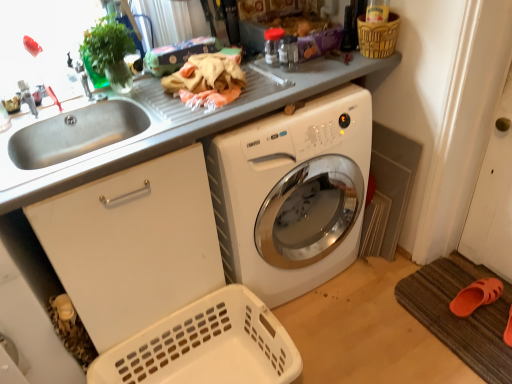
Where is `white glossy washing machine at center`? white glossy washing machine at center is located at coordinates (292, 194).

This screenshot has width=512, height=384. In order to click on white plastic basket at lower left, the 1th basket ordered from the bottom in this screenshot , I will do `click(206, 346)`.

What do you see at coordinates (73, 138) in the screenshot?
I see `stainless steel sink at left` at bounding box center [73, 138].

Locate an element on the screen. brown textured bath mat at lower right is located at coordinates (459, 317).

Is white plastic basket at lower left, the 1th basket ordered from the bottom, not close to brown textured bath mat at lower right?

No, white plastic basket at lower left, the 1th basket ordered from the bottom, is in close proximity to brown textured bath mat at lower right.

In the scene shown: In terms of size, does white plastic basket at lower left, the 1th basket ordered from the bottom, appear bigger or smaller than brown textured bath mat at lower right?

Clearly, white plastic basket at lower left, the 1th basket ordered from the bottom, is larger in size than brown textured bath mat at lower right.

Is point (286, 377) less distant than point (429, 314)?

Yes, it is.

From the image's perspective, is white plastic basket at lower left, the second basket viewed from the right, located beneath brown textured bath mat at lower right?

Yes.

In order to click on sink above the white glossy washing machine at center (from a real-world perspective) in this screenshot , I will do `click(73, 138)`.

Is stainless steel sink at left bigger than white glossy washing machine at center?

Incorrect, stainless steel sink at left is not larger than white glossy washing machine at center.

Which is behind, point (88, 138) or point (252, 142)?

Positioned behind is point (88, 138).

Consider the image. Visually, is stainless steel sink at left positioned to the left or to the right of white glossy washing machine at center?

stainless steel sink at left is to the left of white glossy washing machine at center.

Can you confirm if brushed metal faucet at upper left is bigger than stainless steel sink at left?

Incorrect, brushed metal faucet at upper left is not larger than stainless steel sink at left.

This screenshot has width=512, height=384. I want to click on sink directly beneath the brushed metal faucet at upper left (from a real-world perspective), so click(x=73, y=138).

Considering the relative positions of white glossy washing machine at center and brown woven basket at upper right, which ranks as the second basket in bottom-to-top order, in the image provided, is white glossy washing machine at center to the left of brown woven basket at upper right, which ranks as the second basket in bottom-to-top order, from the viewer's perspective?

Yes.

Choose the correct answer: Is white glossy washing machine at center inside brown woven basket at upper right, the 2th basket from the left, or outside it?

white glossy washing machine at center lies outside brown woven basket at upper right, the 2th basket from the left.

Considering the positions of points (227, 278) and (393, 17), is point (227, 278) closer to camera compared to point (393, 17)?

That is False.

Considering the relative sizes of brown textured bath mat at lower right and brown woven basket at upper right, which is counted as the 1th basket, starting from the right, in the image provided, is brown textured bath mat at lower right taller than brown woven basket at upper right, which is counted as the 1th basket, starting from the right,?

Incorrect, the height of brown textured bath mat at lower right is not larger of that of brown woven basket at upper right, which is counted as the 1th basket, starting from the right.

Which point is more forward, [454,274] or [396,18]?

The point [396,18] is more forward.

From the image's perspective, between brown textured bath mat at lower right and brown woven basket at upper right, which ranks as the second basket in bottom-to-top order, which one is located above?

From the image's view, brown woven basket at upper right, which ranks as the second basket in bottom-to-top order, is above.

Would you say brown textured bath mat at lower right is inside or outside brown woven basket at upper right, the 2th basket from the left?

brown textured bath mat at lower right is not inside brown woven basket at upper right, the 2th basket from the left, it's outside.

How different are the orientations of white plastic basket at lower left, the 1th basket viewed from the left, and stainless steel sink at left in degrees?

There is a 2.44-degree angle between the facing directions of white plastic basket at lower left, the 1th basket viewed from the left, and stainless steel sink at left.

From the picture: From the image's perspective, who appears lower, white plastic basket at lower left, the 1th basket ordered from the bottom, or stainless steel sink at left?

From the image's view, white plastic basket at lower left, the 1th basket ordered from the bottom, is below.

From a real-world perspective, between white plastic basket at lower left, the 1th basket viewed from the left, and stainless steel sink at left, who is vertically higher?

From a 3D spatial view, stainless steel sink at left is above.

Considering the sizes of brown woven basket at upper right, the 2th basket from the left, and stainless steel sink at left in the image, is brown woven basket at upper right, the 2th basket from the left, wider or thinner than stainless steel sink at left?

In the image, brown woven basket at upper right, the 2th basket from the left, appears to be more narrow than stainless steel sink at left.

Locate an element on the screen. sink below the brown woven basket at upper right, which ranks as the 1th basket in top-to-bottom order (from a real-world perspective) is located at coordinates (73, 138).

Consider the image. Can you confirm if brown woven basket at upper right, which ranks as the second basket in bottom-to-top order, is taller than stainless steel sink at left?

In fact, brown woven basket at upper right, which ranks as the second basket in bottom-to-top order, may be shorter than stainless steel sink at left.

The height and width of the screenshot is (384, 512). I want to click on bath mat above the white plastic basket at lower left, the 1th basket viewed from the left (from the image's perspective), so click(459, 317).

Where is `washing machine that appears below the stainless steel sink at left (from the image's perspective)`? washing machine that appears below the stainless steel sink at left (from the image's perspective) is located at coordinates (292, 194).

Considering their positions, is white plastic basket at lower left, which is the second basket in top-to-bottom order, positioned closer to stainless steel sink at left than brown textured bath mat at lower right?

white plastic basket at lower left, which is the second basket in top-to-bottom order, lies closer to stainless steel sink at left than the other object.

From the image, which object appears to be farther from brown woven basket at upper right, which ranks as the second basket in bottom-to-top order, white plastic basket at lower left, which is the second basket in top-to-bottom order, or brushed metal faucet at upper left?

brushed metal faucet at upper left is further to brown woven basket at upper right, which ranks as the second basket in bottom-to-top order.

In the scene shown: Looking at the image, which one is located closer to white glossy washing machine at center, white plastic basket at lower left, the 1th basket viewed from the left, or brown textured bath mat at lower right?

white plastic basket at lower left, the 1th basket viewed from the left, lies closer to white glossy washing machine at center than the other object.

Which object lies further to the anchor point brown woven basket at upper right, the 2th basket from the left, white glossy washing machine at center or stainless steel sink at left?

stainless steel sink at left is positioned further to the anchor brown woven basket at upper right, the 2th basket from the left.

From the image, which object appears to be nearer to white glossy washing machine at center, white plastic basket at lower left, the 1th basket ordered from the bottom, or brushed metal faucet at upper left?

The object closer to white glossy washing machine at center is white plastic basket at lower left, the 1th basket ordered from the bottom.

Considering their positions, is brushed metal faucet at upper left positioned closer to white plastic basket at lower left, the 1th basket viewed from the left, than stainless steel sink at left?

Among the two, stainless steel sink at left is located nearer to white plastic basket at lower left, the 1th basket viewed from the left.

Considering their positions, is brushed metal faucet at upper left positioned further to stainless steel sink at left than brown textured bath mat at lower right?

brown textured bath mat at lower right.

When comparing their distances from white glossy washing machine at center, does brown textured bath mat at lower right or white plastic basket at lower left, which is the second basket in top-to-bottom order, seem further?

brown textured bath mat at lower right is further to white glossy washing machine at center.

Identify the location of faucet between brown woven basket at upper right, the 2th basket from the left, and white plastic basket at lower left, the 1th basket ordered from the bottom, from top to bottom. Image resolution: width=512 pixels, height=384 pixels. (27, 97).

Where is `sink located between brushed metal faucet at upper left and brown textured bath mat at lower right in the left-right direction`? sink located between brushed metal faucet at upper left and brown textured bath mat at lower right in the left-right direction is located at coordinates (73, 138).

The width and height of the screenshot is (512, 384). I want to click on washing machine between brushed metal faucet at upper left and white plastic basket at lower left, the 1th basket viewed from the left, from top to bottom, so click(292, 194).

The width and height of the screenshot is (512, 384). What are the coordinates of `washing machine between stainless steel sink at left and brown woven basket at upper right, the 2th basket from the left` in the screenshot? It's located at (292, 194).